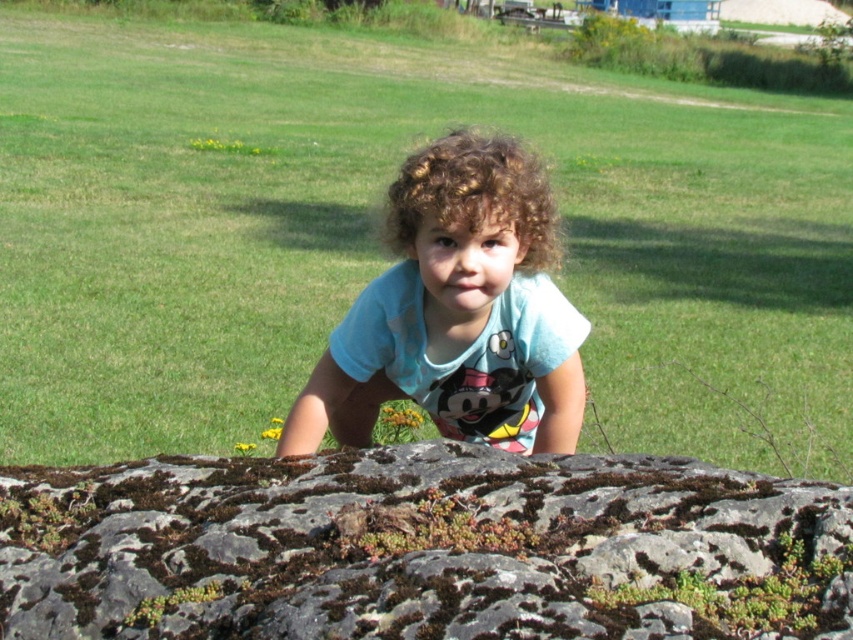
Question: Is the position of green mossy rock at center less distant than that of curly brown hair at center?

Choices:
 (A) yes
 (B) no

Answer: (A)

Question: Which object is positioned closest to the curly brown hair at center?

Choices:
 (A) green mossy rock at center
 (B) light blue cotton shirt at center

Answer: (A)

Question: Which of the following is the farthest from the observer?

Choices:
 (A) light blue cotton shirt at center
 (B) green mossy rock at center

Answer: (A)

Question: Can you confirm if green mossy rock at center is positioned above light blue cotton shirt at center?

Choices:
 (A) yes
 (B) no

Answer: (B)

Question: In this image, where is green mossy rock at center located relative to light blue cotton shirt at center?

Choices:
 (A) right
 (B) left

Answer: (B)

Question: Which point is farther to the camera?

Choices:
 (A) (372, 380)
 (B) (494, 193)

Answer: (A)